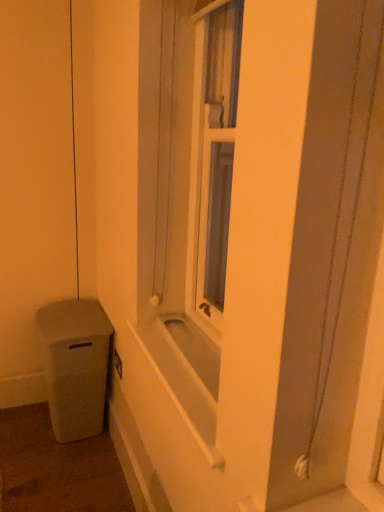
This screenshot has width=384, height=512. Find the location of `free spot above white matte bathtub at center (from a real-world perspective)`. free spot above white matte bathtub at center (from a real-world perspective) is located at coordinates (185, 345).